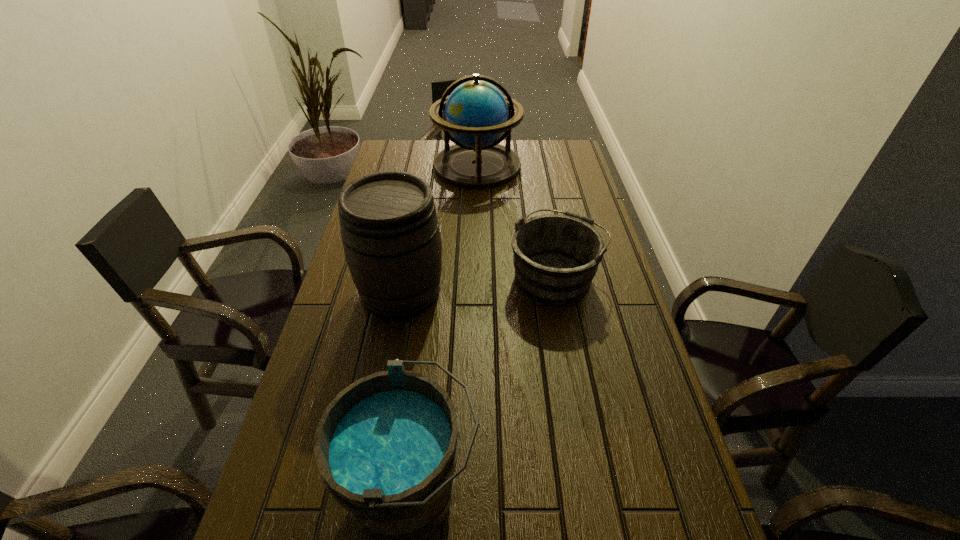
At what (x,y) coordinates should I click in order to perform the action: click on globe. Please return your answer as a coordinate pair (x, y). This screenshot has width=960, height=540. Looking at the image, I should click on (475, 115).

The height and width of the screenshot is (540, 960). In order to click on the shortest wine bucket in this screenshot , I will do `click(556, 257)`.

Identify the location of the shortest object. This screenshot has height=540, width=960. (556, 257).

Where is `vacant space located on the left of the globe`? The height and width of the screenshot is (540, 960). vacant space located on the left of the globe is located at coordinates (412, 166).

At what (x,y) coordinates should I click in order to perform the action: click on free location located 0.120m on the back of the shortest wine bucket. Please return your answer as a coordinate pair (x, y). Looking at the image, I should click on (546, 223).

At what (x,y) coordinates should I click in order to perform the action: click on object that is at the far edge. Please return your answer as a coordinate pair (x, y). The height and width of the screenshot is (540, 960). Looking at the image, I should click on (475, 115).

The height and width of the screenshot is (540, 960). I want to click on object that is at the left edge, so click(390, 232).

This screenshot has height=540, width=960. What are the coordinates of `object present at the right edge` in the screenshot? It's located at (556, 257).

Where is `vacant space at the far edge of the desktop`? vacant space at the far edge of the desktop is located at coordinates (428, 145).

Identify the location of vacant space at the left edge. (354, 334).